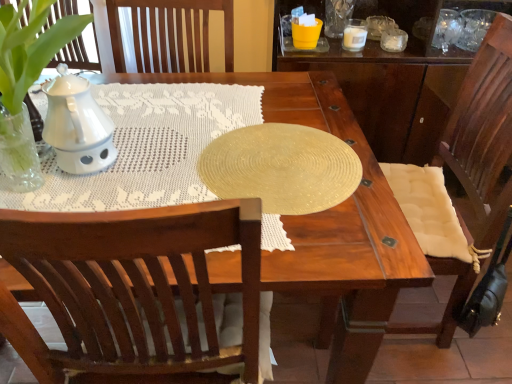
Question: From the image's perspective, is shiny gold placemat at center located above or below white textured cushion at right?

Choices:
 (A) below
 (B) above

Answer: (B)

Question: Is shiny gold placemat at center taller or shorter than white textured cushion at right?

Choices:
 (A) short
 (B) tall

Answer: (A)

Question: Which of these objects is positioned closest to the white textured cushion at right?

Choices:
 (A) white ceramic candle at upper right
 (B) shiny gold placemat at center

Answer: (B)

Question: Estimate the real-world distances between objects in this image. Which object is closer to the shiny gold placemat at center?

Choices:
 (A) white ceramic candle at upper right
 (B) white textured cushion at right

Answer: (B)